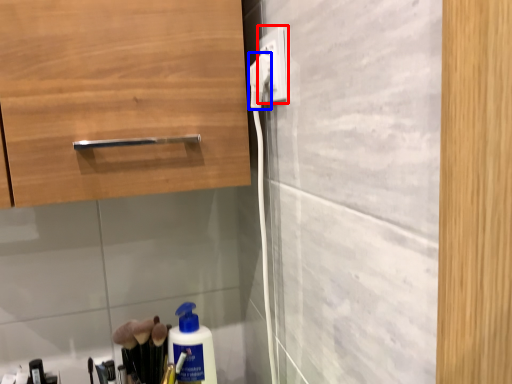
Question: Which object appears farthest to the camera in this image, electric outlet (highlighted by a red box) or electric outlet (highlighted by a blue box)?

Choices:
 (A) electric outlet
 (B) electric outlet

Answer: (B)